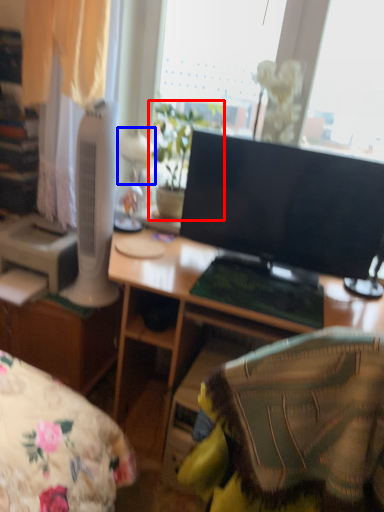
Question: Among these objects, which one is nearest to the camera, houseplant (highlighted by a red box) or table lamp (highlighted by a blue box)?

Choices:
 (A) houseplant
 (B) table lamp

Answer: (A)